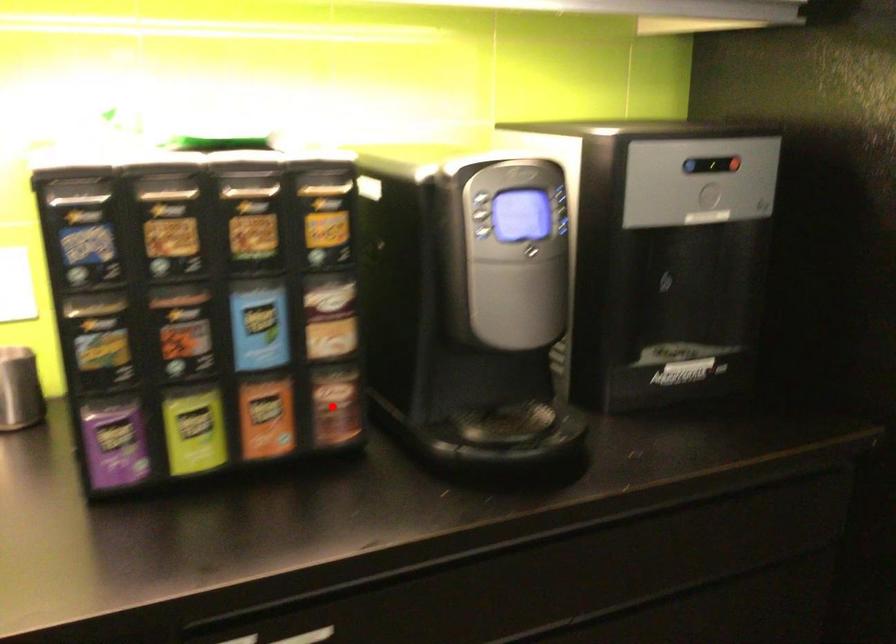
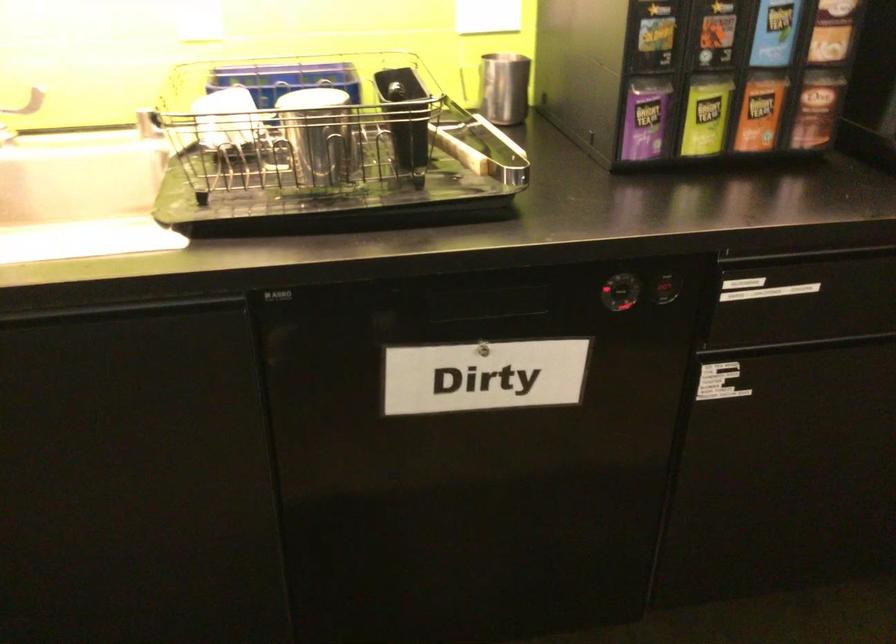
Question: I am providing you with two images of the same scene from different viewpoints. A red point is shown in image1. For the corresponding object point in image2, is it positioned nearer or farther from the camera?

Choices:
 (A) Nearer
 (B) Farther

Answer: (B)